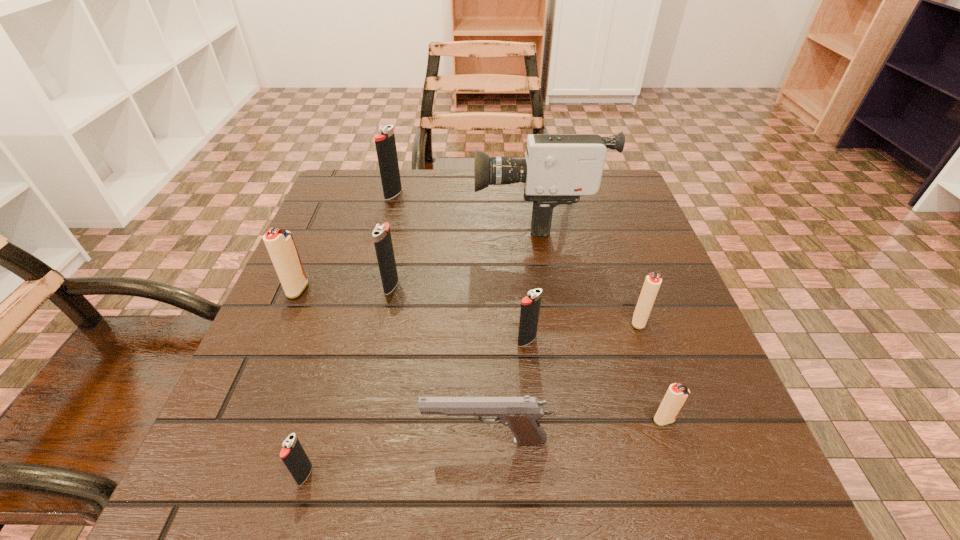
Find the location of `free space at the right edge of the desktop`. free space at the right edge of the desktop is located at coordinates (599, 254).

The height and width of the screenshot is (540, 960). In the image, there is a desktop. In order to click on free space at the far left corner in this screenshot , I will do `click(358, 175)`.

Identify the location of vacant space at the far right corner of the desktop. This screenshot has width=960, height=540. (602, 193).

Where is `free spot between the farthest igniter and the leftmost igniter`? The height and width of the screenshot is (540, 960). free spot between the farthest igniter and the leftmost igniter is located at coordinates (346, 242).

Identify the location of blank region between the leftmost igniter and the pistol. The width and height of the screenshot is (960, 540). (392, 365).

Locate an element on the screen. free point between the nearest red igniter and the fourth farthest igniter is located at coordinates (652, 370).

Where is `vacant space that's between the third nearest igniter and the tallest igniter`? The height and width of the screenshot is (540, 960). vacant space that's between the third nearest igniter and the tallest igniter is located at coordinates tap(460, 267).

At what (x,y) coordinates should I click in order to perform the action: click on free spot between the fourth nearest object and the pistol. Please return your answer as a coordinate pair (x, y). Looking at the image, I should click on (506, 390).

Find the location of a particular element. free space that is in between the leftmost igniter and the eighth farthest object is located at coordinates (392, 365).

This screenshot has height=540, width=960. What are the coordinates of `free area in between the fifth igniter from left to right and the nearest red igniter` in the screenshot? It's located at (595, 380).